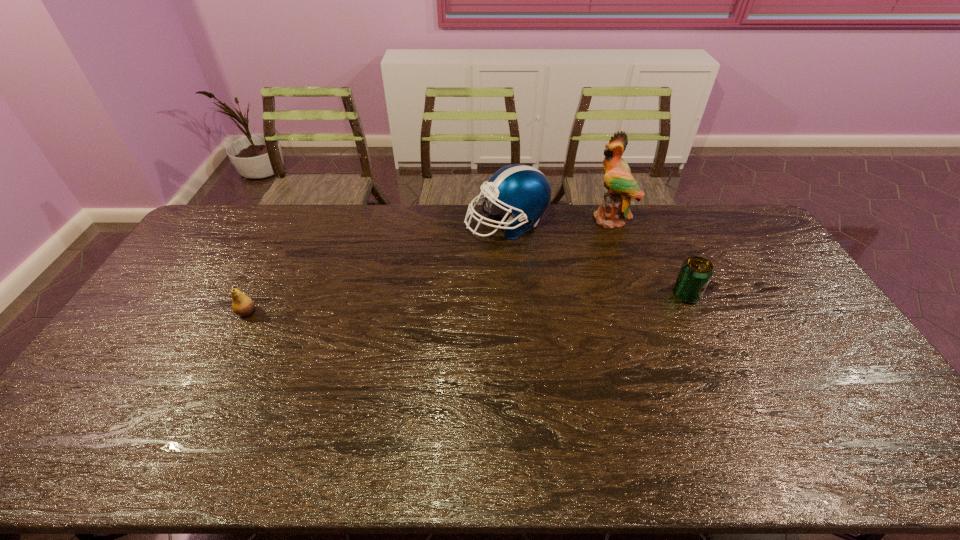
Identify the location of the leftmost object. This screenshot has width=960, height=540. (242, 305).

Where is `beer can`? beer can is located at coordinates (694, 276).

The image size is (960, 540). In order to click on the third object from right to left in this screenshot , I will do `click(524, 190)`.

You are a GUI agent. You are given a task and a screenshot of the screen. Output one action in this format:
    pyautogui.click(x=<x>, y=<y>)
    Task: Click on the football helmet
    
    Given the screenshot: What is the action you would take?
    click(x=524, y=190)

Locate an element on the screen. Image resolution: width=960 pixels, height=540 pixels. the third object from left to right is located at coordinates (621, 186).

Where is `parrot`? This screenshot has height=540, width=960. parrot is located at coordinates (621, 186).

Locate an element on the screen. This screenshot has height=540, width=960. vacant region located 0.190m on the back of the leftmost object is located at coordinates (272, 264).

Locate an element on the screen. The image size is (960, 540). vacant space located on the left of the rightmost object is located at coordinates (559, 295).

The height and width of the screenshot is (540, 960). I want to click on free spot located at the front of the third object from right to left with the faceguard, so click(x=477, y=261).

Find the location of a particular element. vacant space located 0.360m at the front of the third object from right to left with the faceguard is located at coordinates (444, 312).